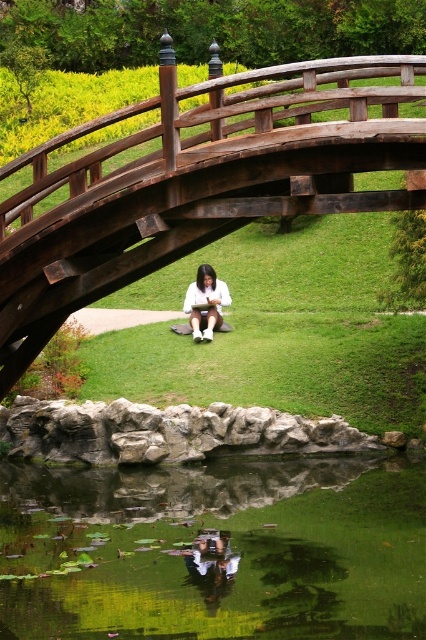
Can you confirm if dark brown wood bridge at center is positioned to the left of white matte shirt at center?

In fact, dark brown wood bridge at center is to the right of white matte shirt at center.

Is dark brown wood bridge at center thinner than white matte shirt at center?

No, dark brown wood bridge at center is not thinner than white matte shirt at center.

The image size is (426, 640). What do you see at coordinates (198, 180) in the screenshot?
I see `dark brown wood bridge at center` at bounding box center [198, 180].

Where is `dark brown wood bridge at center`? Image resolution: width=426 pixels, height=640 pixels. dark brown wood bridge at center is located at coordinates (198, 180).

Find the location of a particular element. This screenshot has width=426, height=640. green reflective water at center bottom is located at coordinates (230, 550).

Who is more distant from viewer, [363,540] or [408,54]?

The point [408,54] is more distant.

At what (x,y) coordinates should I click in order to perform the action: click on green reflective water at center bottom. Please return your answer as a coordinate pair (x, y). Image resolution: width=426 pixels, height=640 pixels. Looking at the image, I should click on (230, 550).

Is green reflective water at center bottom behind white matte shirt at center?

No, green reflective water at center bottom is in front of white matte shirt at center.

Is point (121, 508) in front of point (216, 312)?

Yes.

Find the location of `green reflective water at center bottom`. green reflective water at center bottom is located at coordinates [230, 550].